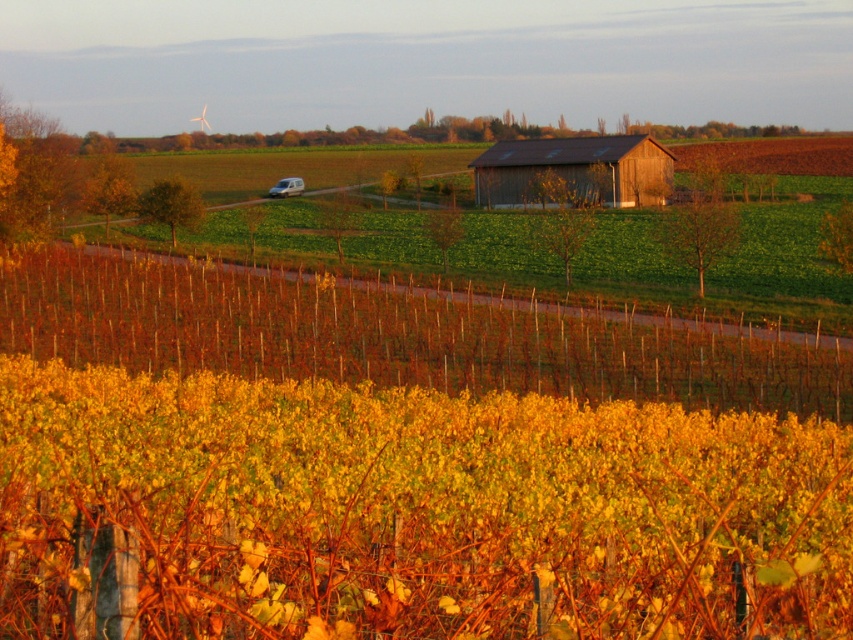
Can you confirm if yellow-green leaves at lower center is shorter than wooden barn at center?

Yes, yellow-green leaves at lower center is shorter than wooden barn at center.

Who is higher up, yellow-green leaves at lower center or wooden barn at center?

Positioned higher is wooden barn at center.

What do you see at coordinates (393, 337) in the screenshot? I see `yellow-green leaves at lower center` at bounding box center [393, 337].

This screenshot has width=853, height=640. I want to click on yellow-green leaves at lower center, so click(x=393, y=337).